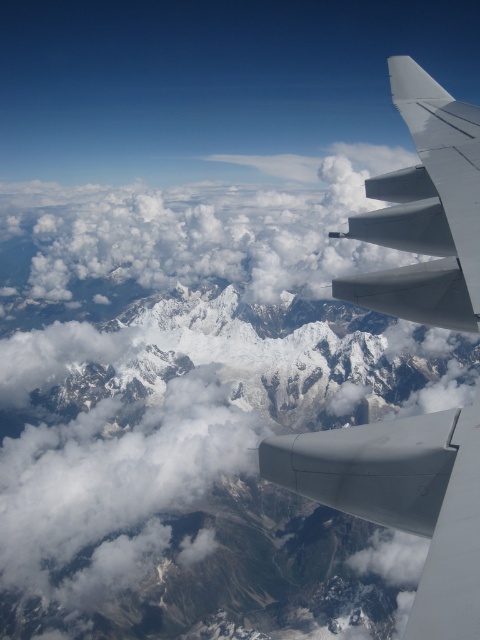
Is matte gray wing at right taller than white matte wing at upper right?

Yes, matte gray wing at right is taller than white matte wing at upper right.

Is matte gray wing at right smaller than white matte wing at upper right?

No, matte gray wing at right is not smaller than white matte wing at upper right.

The image size is (480, 640). Describe the element at coordinates (403, 499) in the screenshot. I see `matte gray wing at right` at that location.

This screenshot has width=480, height=640. I want to click on matte gray wing at right, so click(403, 499).

Is matte gray wing at right shorter than gray matte engine at center?

No.

Between matte gray wing at right and gray matte engine at center, which one is positioned higher?

Positioned higher is matte gray wing at right.

This screenshot has width=480, height=640. What do you see at coordinates (403, 499) in the screenshot?
I see `matte gray wing at right` at bounding box center [403, 499].

This screenshot has width=480, height=640. I want to click on matte gray wing at right, so click(x=403, y=499).

Is white fluffy cloud at center taller than gray matte engine at center?

Yes.

Between point (273, 292) and point (348, 458), which one is positioned behind?

The point (273, 292) is behind.

The image size is (480, 640). In order to click on white fluffy cloud at center in this screenshot , I will do `click(187, 236)`.